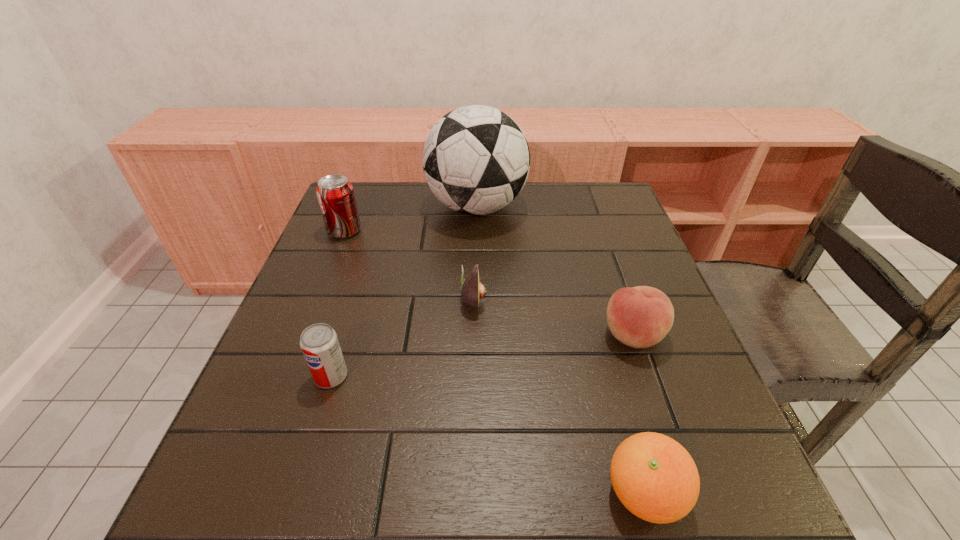
Identify the location of soccer ball. (476, 159).

This screenshot has height=540, width=960. What are the coordinates of `the left soda` in the screenshot? It's located at (335, 194).

Where is `the leftmost object`? the leftmost object is located at coordinates (335, 194).

Where is `avocado`? avocado is located at coordinates (472, 290).

At what (x,y) coordinates should I click in order to perform the action: click on the right soda. Please return your answer as a coordinate pair (x, y). Looking at the image, I should click on (319, 343).

The image size is (960, 540). Identify the location of the shorter soda. (319, 343).

In order to click on peach in this screenshot , I will do `click(640, 317)`.

You are a GUI agent. You are given a task and a screenshot of the screen. Output one action in this format:
    pyautogui.click(x=<x>, y=<y>)
    Task: Click on the nearest object
    Image resolution: width=960 pixels, height=540 pixels.
    Given the screenshot: What is the action you would take?
    pyautogui.click(x=655, y=478)

Find the location of a particular element. This screenshot has height=540, width=960. free spot located on the surface of the soccer ball where the brand logo is visible is located at coordinates (603, 207).

Where is `free location located 0.180m on the front of the leftmost object`? The image size is (960, 540). free location located 0.180m on the front of the leftmost object is located at coordinates (322, 288).